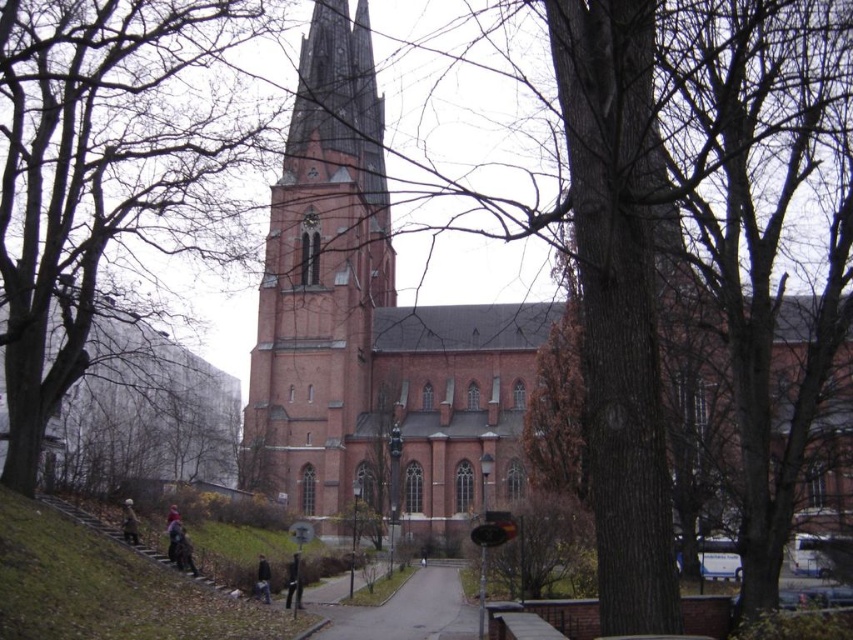
You are standing at the entrance of the red brick church at center. From your perspective, what are the coordinates of the church?

The coordinates of the red brick church at center are at point (370, 326).

You are standing on the pathway leading to the church and notice the smooth brown tree trunk at center and the dark blue jacket at lower center. Which object is taller from your viewpoint?

The smooth brown tree trunk at center is taller than the dark blue jacket at lower center according to the description.